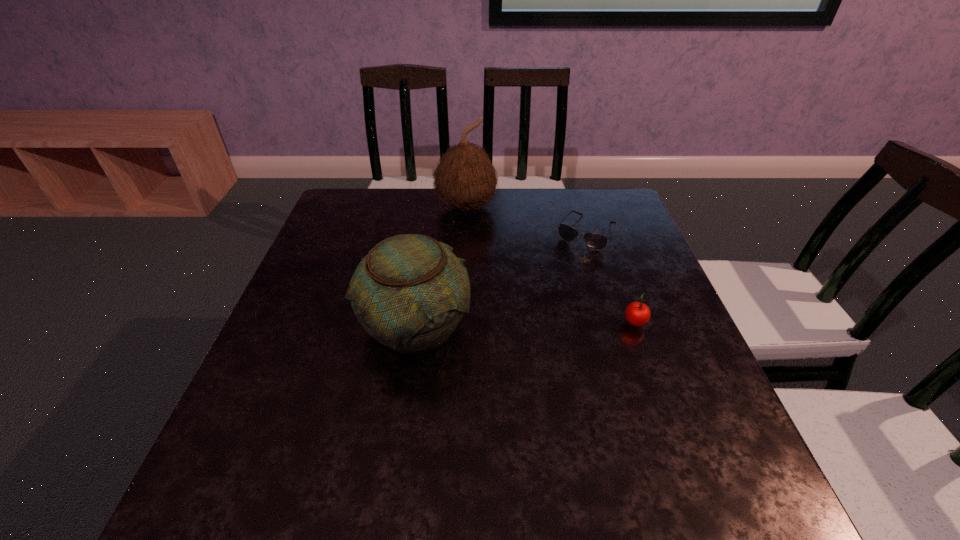
You are a GUI agent. You are given a task and a screenshot of the screen. Output one action in this format:
    pyautogui.click(x=<x>, y=<y>)
    Task: Click on the free spot between the pottery and the third tallest object
    The width and height of the screenshot is (960, 540).
    Given the screenshot: What is the action you would take?
    click(x=525, y=325)

Locate an element on the screen. Image resolution: width=960 pixels, height=540 pixels. object that is the second nearest to the tallest object is located at coordinates (409, 293).

Locate which object is the second closest to the coconut. Please provide its 2D coordinates. Your answer should be formatted as a tuple, i.e. [(x, y)], where the tuple contains the x and y coordinates of a point satisfying the conditions above.

[(409, 293)]

Where is `free location that satisfies the following two spatial constraints: 1. on the back side of the pottery; 2. on the left side of the cherry`? This screenshot has width=960, height=540. free location that satisfies the following two spatial constraints: 1. on the back side of the pottery; 2. on the left side of the cherry is located at coordinates (415, 325).

You are a GUI agent. You are given a task and a screenshot of the screen. Output one action in this format:
    pyautogui.click(x=<x>, y=<y>)
    Task: Click on the free space that satisfies the following two spatial constraints: 1. on the front side of the coconut; 2. on the right side of the shortest object
    This screenshot has height=540, width=960.
    Given the screenshot: What is the action you would take?
    pyautogui.click(x=465, y=233)

I want to click on vacant space that satisfies the following two spatial constraints: 1. on the front side of the tallest object; 2. on the left side of the sunglasses, so click(465, 233).

Where is `free space that satisfies the following two spatial constraints: 1. on the back side of the third shortest object; 2. on the left side of the sunglasses`? This screenshot has width=960, height=540. free space that satisfies the following two spatial constraints: 1. on the back side of the third shortest object; 2. on the left side of the sunglasses is located at coordinates (429, 233).